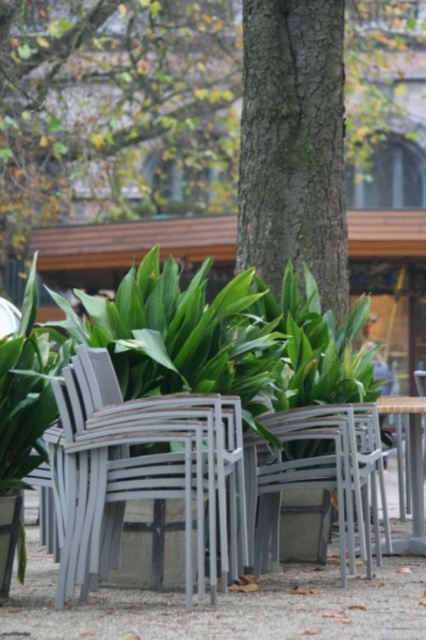
Which of these two, green rough bark tree at center or metallic gray chair at center, stands taller?

With more height is green rough bark tree at center.

Is green rough bark tree at center above metallic gray chair at center?

Indeed, green rough bark tree at center is positioned over metallic gray chair at center.

In order to click on green rough bark tree at center in this screenshot , I will do `click(115, 112)`.

Which of these two, green rough bark tree at center or metallic silver table at center, stands taller?

Standing taller between the two is green rough bark tree at center.

Between green rough bark tree at center and metallic silver table at center, which one appears on the right side from the viewer's perspective?

metallic silver table at center is more to the right.

Locate an element on the screen. The height and width of the screenshot is (640, 426). green rough bark tree at center is located at coordinates (115, 112).

Locate an element on the screen. Image resolution: width=426 pixels, height=640 pixels. green rough bark tree at center is located at coordinates pyautogui.click(x=115, y=112).

Between metallic gray chair at center and metallic silver table at center, which one appears on the right side from the viewer's perspective?

From the viewer's perspective, metallic silver table at center appears more on the right side.

Who is lower down, metallic gray chair at center or metallic silver table at center?

metallic gray chair at center is lower down.

The image size is (426, 640). I want to click on metallic gray chair at center, so click(144, 472).

Where is `metallic gray chair at center`? Image resolution: width=426 pixels, height=640 pixels. metallic gray chair at center is located at coordinates (144, 472).